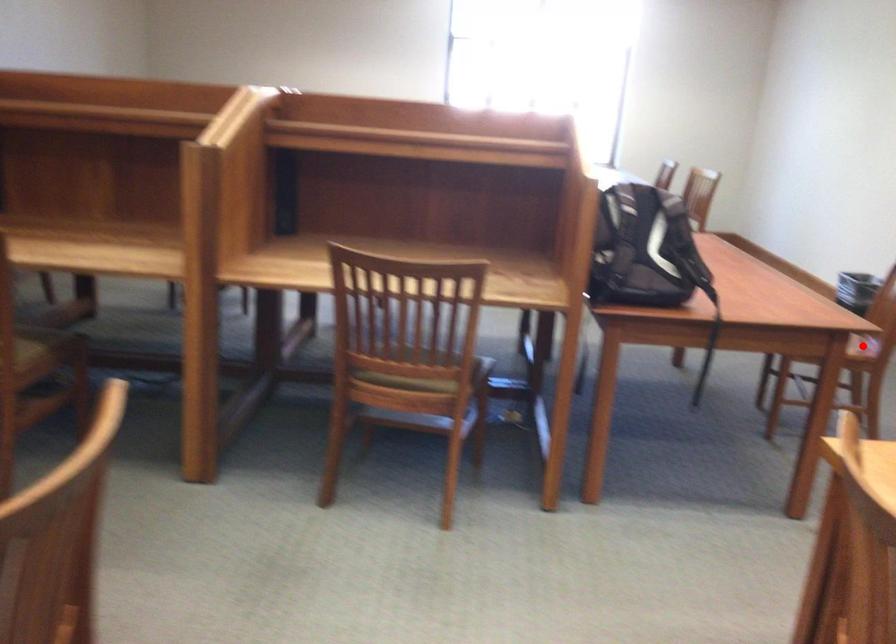
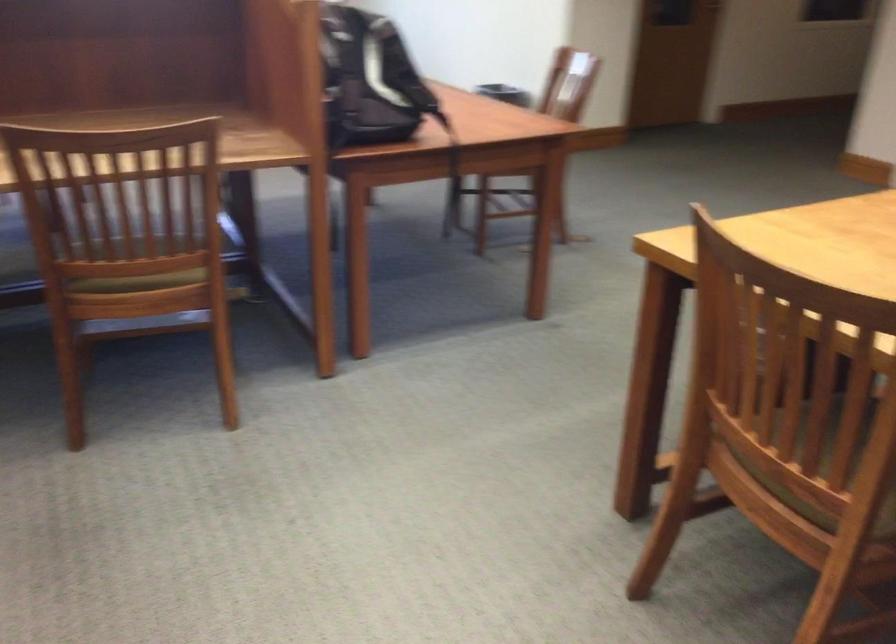
Question: I am providing you with two images of the same scene from different viewpoints. A red point is marked on the first image. Can you still see the location of the red point in image 2?

Choices:
 (A) Yes
 (B) No

Answer: (B)